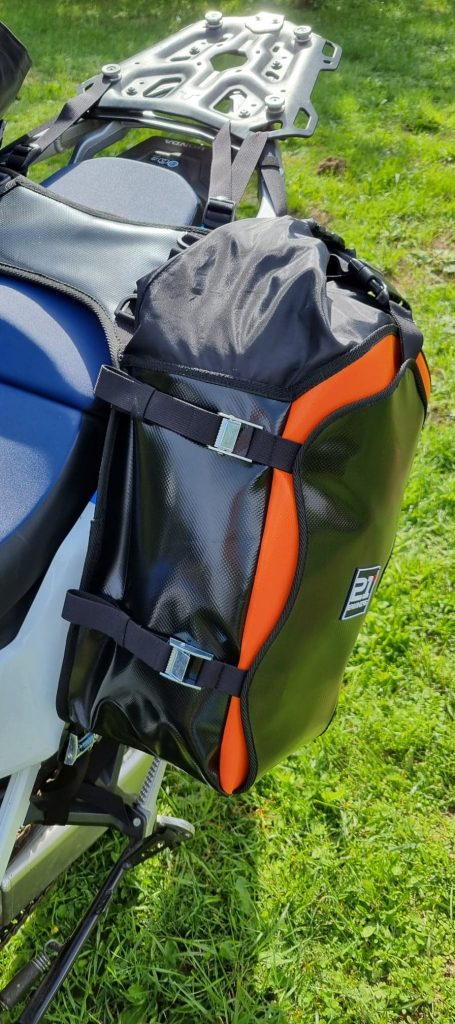
I want to click on rack, so [236, 62].